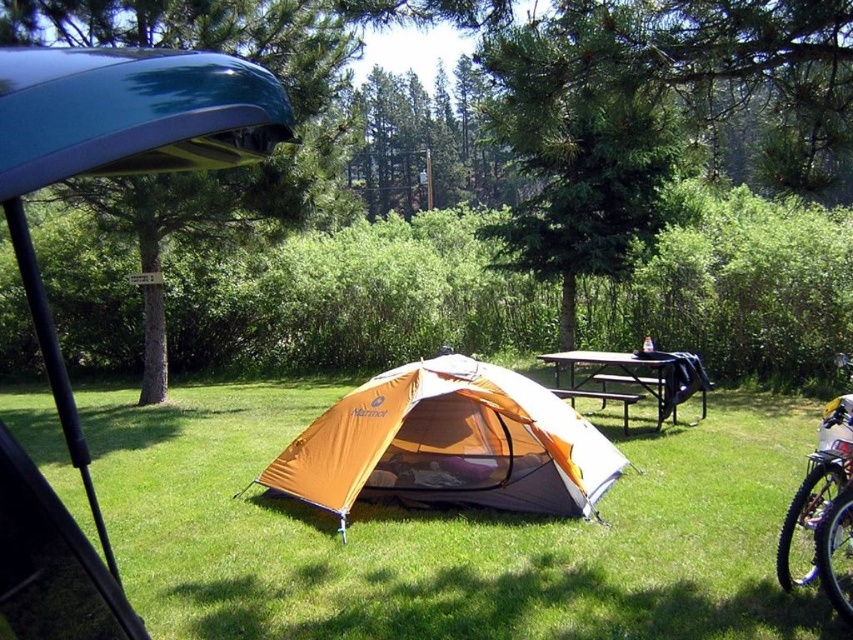
Question: Among these points, which one is farthest from the camera?

Choices:
 (A) (238, 124)
 (B) (837, 356)
 (C) (222, 460)

Answer: (B)

Question: Does orange fabric tent at center appear under teal glossy canoe at upper left?

Choices:
 (A) no
 (B) yes

Answer: (B)

Question: Is teal glossy canoe at upper left to the left of silver metallic mountain bike at right from the viewer's perspective?

Choices:
 (A) yes
 (B) no

Answer: (A)

Question: Which object is the farthest from the metallic black picnic table at center?

Choices:
 (A) orange fabric tent at center
 (B) teal glossy canoe at upper left

Answer: (B)

Question: From the image, what is the correct spatial relationship of silver metallic mountain bike at right in relation to metallic black picnic table at center?

Choices:
 (A) below
 (B) above

Answer: (A)

Question: Which of the following is the farthest from the observer?

Choices:
 (A) (57, 93)
 (B) (831, 433)
 (C) (614, 240)

Answer: (C)